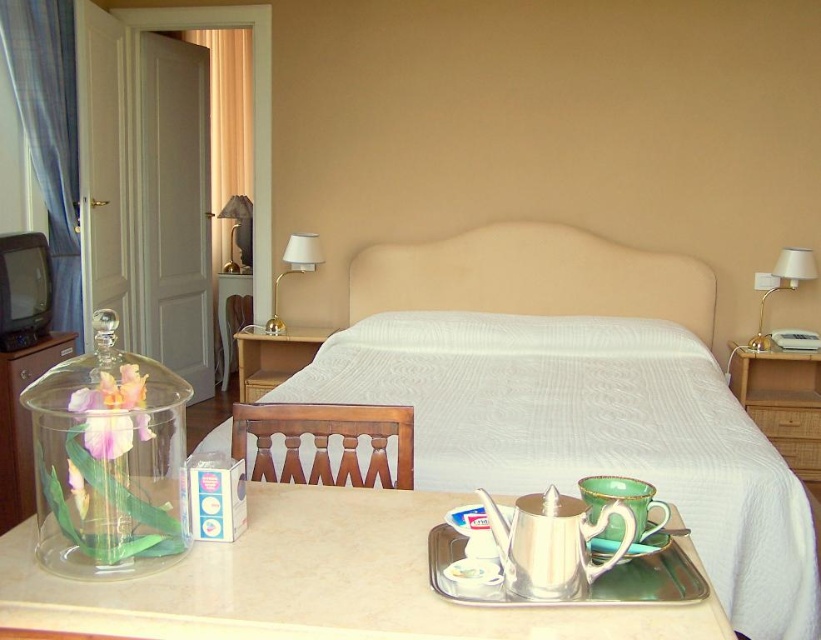
Who is positioned more to the right, white glossy lamp at upper right or green ceramic saucer at lower center?

white glossy lamp at upper right

Which is in front, point (783, 252) or point (634, 556)?

Point (634, 556)

Locate an element on the screen. Image resolution: width=821 pixels, height=640 pixels. white glossy lamp at upper right is located at coordinates (781, 284).

Can you confirm if transparent glass vase at left is wider than clear glass vase at left?

Yes.

Can you confirm if transparent glass vase at left is taller than clear glass vase at left?

Incorrect, transparent glass vase at left's height is not larger of clear glass vase at left's.

Which is in front, point (159, 525) or point (15, 433)?

Point (159, 525) is more forward.

Identify the location of transparent glass vase at left. The height and width of the screenshot is (640, 821). (108, 460).

Between metallic tray at center and clear glass vase at left, which one appears on the right side from the viewer's perspective?

Positioned to the right is metallic tray at center.

Can you confirm if metallic tray at center is shorter than clear glass vase at left?

Yes.

Is point (672, 609) farther from camera compared to point (11, 480)?

No, (672, 609) is in front of (11, 480).

This screenshot has width=821, height=640. What are the coordinates of `metallic tray at center` in the screenshot? It's located at (314, 582).